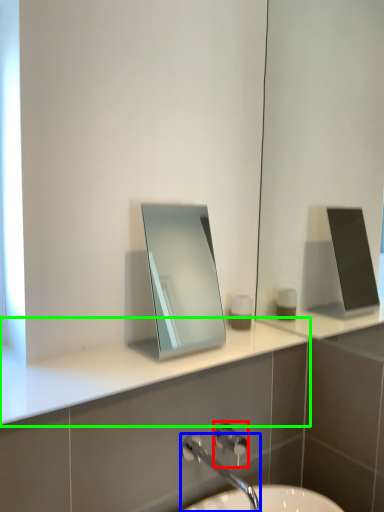
Question: Which object is positioned closest to shower (highlighted by a red box)? Select from tap (highlighted by a blue box) and counter top (highlighted by a green box).

Choices:
 (A) tap
 (B) counter top

Answer: (A)